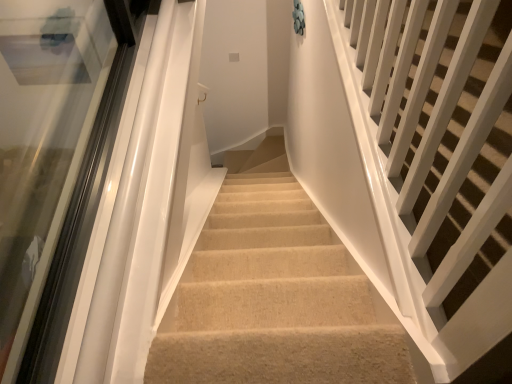
Question: Does transparent glass door at left contain white glossy railings at upper right?

Choices:
 (A) yes
 (B) no

Answer: (B)

Question: From the image's perspective, does transparent glass door at left appear lower than white glossy railings at upper right?

Choices:
 (A) no
 (B) yes

Answer: (B)

Question: Is transparent glass door at left looking in the opposite direction of white glossy railings at upper right?

Choices:
 (A) no
 (B) yes

Answer: (A)

Question: Can you confirm if transparent glass door at left is wider than white glossy railings at upper right?

Choices:
 (A) no
 (B) yes

Answer: (A)

Question: Considering the relative sizes of transparent glass door at left and white glossy railings at upper right in the image provided, is transparent glass door at left taller than white glossy railings at upper right?

Choices:
 (A) yes
 (B) no

Answer: (B)

Question: Does transparent glass door at left lie in front of white glossy railings at upper right?

Choices:
 (A) no
 (B) yes

Answer: (A)

Question: From a real-world perspective, is white glossy railings at upper right positioned under transparent glass door at left based on gravity?

Choices:
 (A) no
 (B) yes

Answer: (A)

Question: Considering the relative positions of white glossy railings at upper right and transparent glass door at left in the image provided, is white glossy railings at upper right to the right of transparent glass door at left from the viewer's perspective?

Choices:
 (A) no
 (B) yes

Answer: (B)

Question: Would you consider white glossy railings at upper right to be distant from transparent glass door at left?

Choices:
 (A) yes
 (B) no

Answer: (A)

Question: Does white glossy railings at upper right have a lesser width compared to transparent glass door at left?

Choices:
 (A) no
 (B) yes

Answer: (A)

Question: Can you confirm if white glossy railings at upper right is positioned to the left of transparent glass door at left?

Choices:
 (A) no
 (B) yes

Answer: (A)

Question: Is white glossy railings at upper right located outside transparent glass door at left?

Choices:
 (A) no
 (B) yes

Answer: (B)

Question: Is white glossy railings at upper right to the left or to the right of transparent glass door at left in the image?

Choices:
 (A) left
 (B) right

Answer: (B)